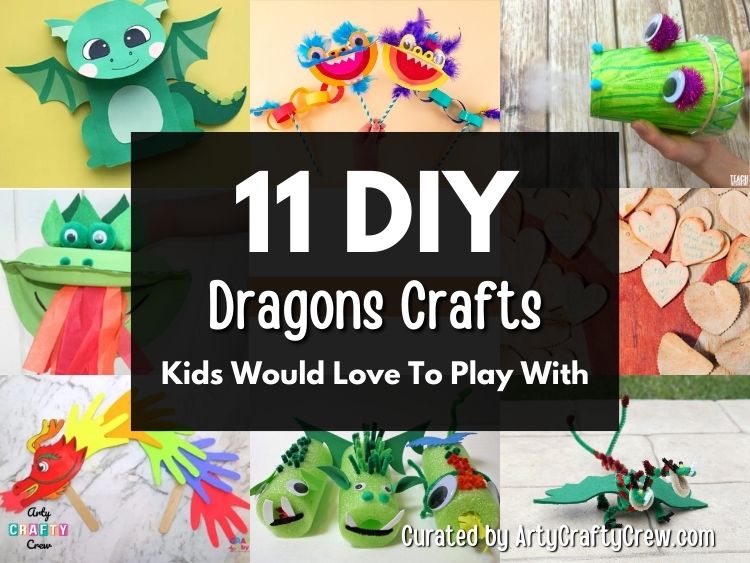
Image resolution: width=750 pixels, height=563 pixels. I want to click on wood table, so click(578, 33).